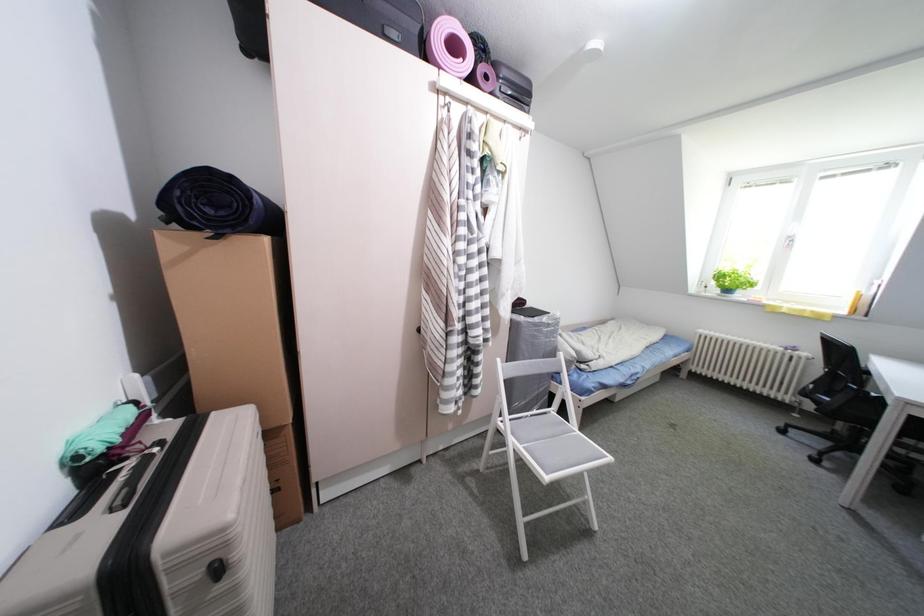
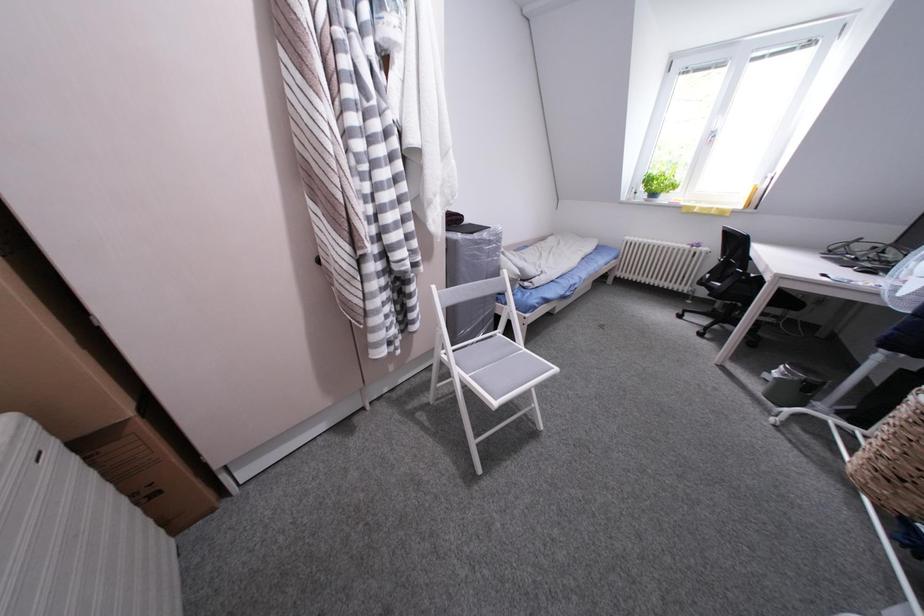
Question: The images are taken continuously from a first-person perspective. In which direction is your viewpoint rotating?

Choices:
 (A) Left
 (B) Right
 (C) Up
 (D) Down

Answer: (D)